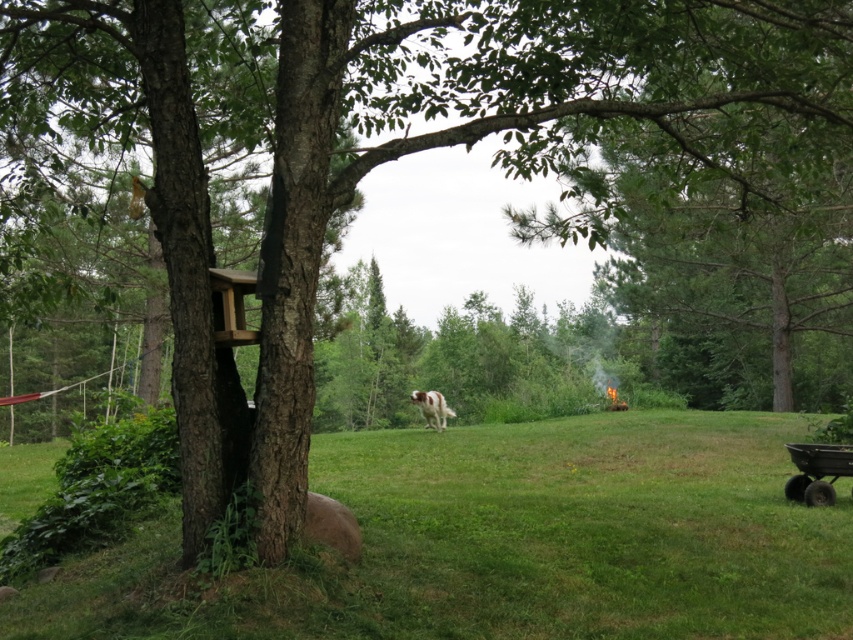
Is point (770, 444) farther from camera compared to point (428, 424)?

No, it is in front of (428, 424).

Is green grass at center above white fur with brown spots at center?

Actually, green grass at center is below white fur with brown spots at center.

Image resolution: width=853 pixels, height=640 pixels. Describe the element at coordinates (511, 541) in the screenshot. I see `green grass at center` at that location.

Identify the location of green grass at center. The height and width of the screenshot is (640, 853). (511, 541).